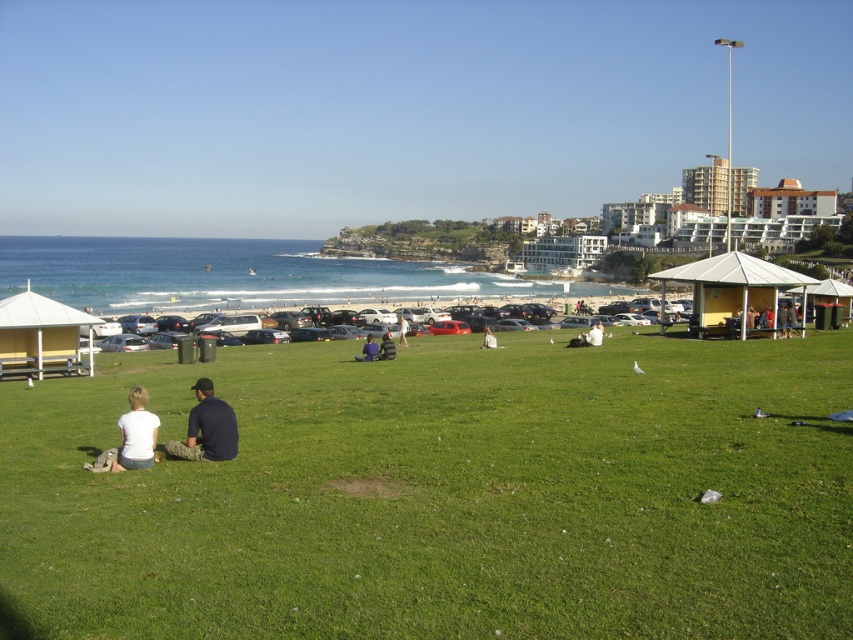
Question: Which of the following is the farthest from the observer?

Choices:
 (A) white fabric person at lower center
 (B) green grassy field at lower center
 (C) matte black jacket at center
 (D) dark blue shirt at center

Answer: (A)

Question: Is white matte shirt at lower left closer to the viewer compared to matte black jacket at center?

Choices:
 (A) no
 (B) yes

Answer: (B)

Question: Observing the image, what is the correct spatial positioning of dark blue shirt at center in reference to white fabric bag at center?

Choices:
 (A) right
 (B) left

Answer: (B)

Question: Which is nearer to the dark blue shirt at center?

Choices:
 (A) light blue denim shorts at center
 (B) green grassy field at lower center
 (C) white fabric bag at center

Answer: (C)

Question: Is green grassy field at lower center to the left of white fabric person at lower center from the viewer's perspective?

Choices:
 (A) no
 (B) yes

Answer: (B)

Question: Which object is closer to the camera taking this photo?

Choices:
 (A) white matte shirt at lower left
 (B) white fabric person at lower center
 (C) green grassy field at lower center
 (D) dark blue shirt at center

Answer: (C)